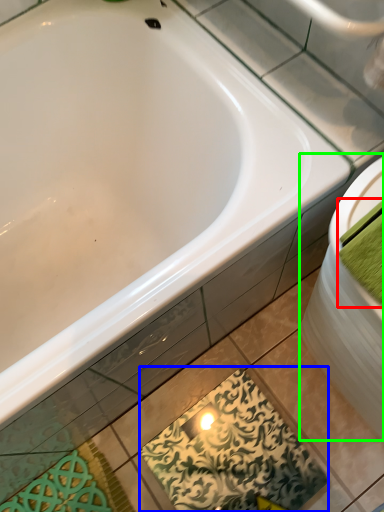
Question: Based on their relative distances, which object is farther from bath towel (highlighted by a red box)? Choose from design (highlighted by a blue box) and sink (highlighted by a green box).

Choices:
 (A) design
 (B) sink

Answer: (A)